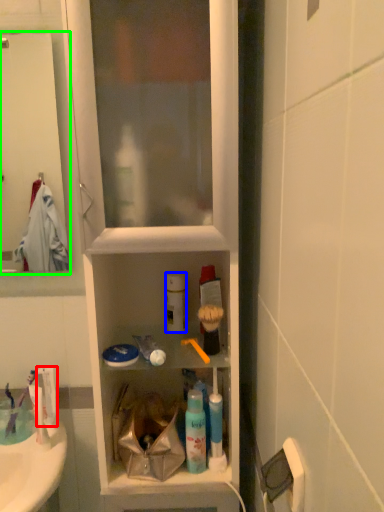
Question: Based on their relative distances, which object is farther from toothpaste (highlighted by a red box)? Choose from cleaning product (highlighted by a blue box) and screen door (highlighted by a green box).

Choices:
 (A) cleaning product
 (B) screen door

Answer: (B)